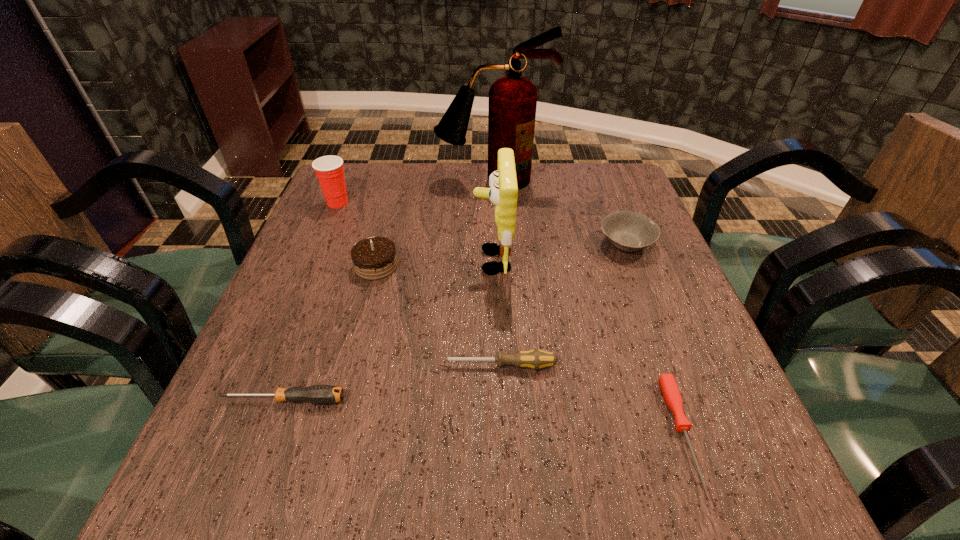
The image size is (960, 540). Identify the location of the farthest object. (512, 104).

You are a GUI agent. You are given a task and a screenshot of the screen. Output one action in this format:
    pyautogui.click(x=<x>, y=<y>)
    Task: Click on the fire extinguisher
    
    Given the screenshot: What is the action you would take?
    pyautogui.click(x=512, y=104)

Image resolution: width=960 pixels, height=540 pixels. I want to click on sponge, so click(503, 191).

You are a GUI agent. You are given a task and a screenshot of the screen. Output one action in this format:
    pyautogui.click(x=<x>, y=<y>)
    Task: Click on the second farthest object
    
    Given the screenshot: What is the action you would take?
    pyautogui.click(x=329, y=169)

Find the location of a particular element. the third tallest object is located at coordinates (329, 169).

You are a GUI agent. You are given a task and a screenshot of the screen. Output one action in this format:
    pyautogui.click(x=<x>, y=<y>)
    Task: Click on the fourth tallest object
    This screenshot has height=540, width=960.
    Given the screenshot: What is the action you would take?
    pyautogui.click(x=374, y=258)

The height and width of the screenshot is (540, 960). Find the location of `bowl`. bowl is located at coordinates (629, 231).

The width and height of the screenshot is (960, 540). Identify the location of the farthest screwdriver. (535, 359).

Where is `the second screwdriver from right to left`? This screenshot has height=540, width=960. the second screwdriver from right to left is located at coordinates (535, 359).

At what (x,y) coordinates should I click in order to perform the action: click on the leftmost screwdriver. Please return your answer as a coordinate pair (x, y). This screenshot has height=540, width=960. Looking at the image, I should click on (317, 394).